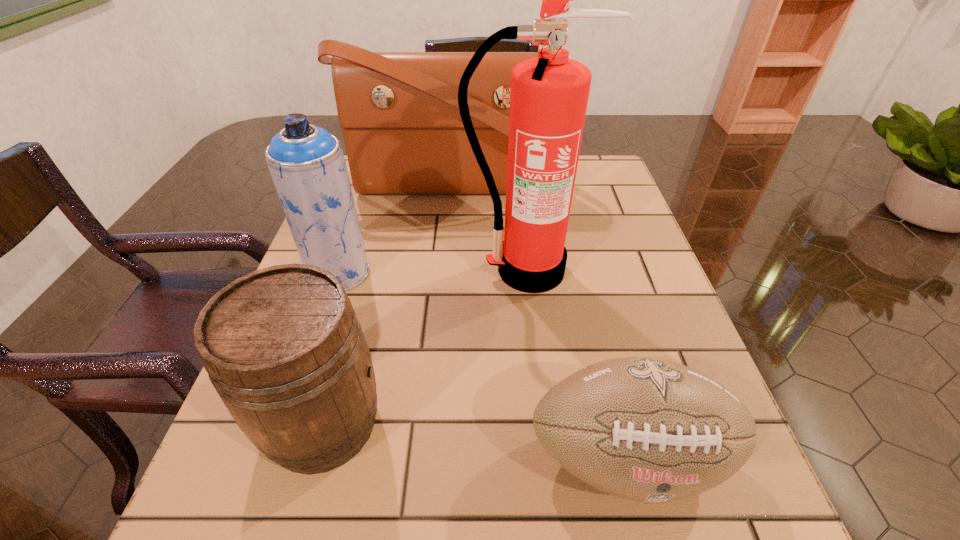
You are a GUI agent. You are given a task and a screenshot of the screen. Output one action in this format:
    pyautogui.click(x=<x>, y=<y>)
    Task: Click on the object located at the near edge
    The height and width of the screenshot is (540, 960).
    Given the screenshot: What is the action you would take?
    pyautogui.click(x=644, y=429)

The height and width of the screenshot is (540, 960). Find the location of `satchel that is positioned at the left edge`. satchel that is positioned at the left edge is located at coordinates (399, 112).

Where is `aerosol can located in the left edge section of the desktop`? The image size is (960, 540). aerosol can located in the left edge section of the desktop is located at coordinates (307, 165).

Identify the location of cider positioned at the left edge. (283, 347).

This screenshot has width=960, height=540. Identify the location of fire extinguisher that is at the right edge. (549, 95).

Identify the location of satchel present at the right edge. The height and width of the screenshot is (540, 960). (399, 112).

The width and height of the screenshot is (960, 540). Identify the location of football (American) present at the right edge. (644, 429).

Where is `object that is at the far left corner`? Image resolution: width=960 pixels, height=540 pixels. object that is at the far left corner is located at coordinates (399, 112).

At what (x,y) coordinates should I click in order to perform the action: click on object at the far right corner. Please return your answer as a coordinate pair (x, y). Image resolution: width=960 pixels, height=540 pixels. Looking at the image, I should click on (399, 112).

Identify the location of object located at the near right corner. (644, 429).